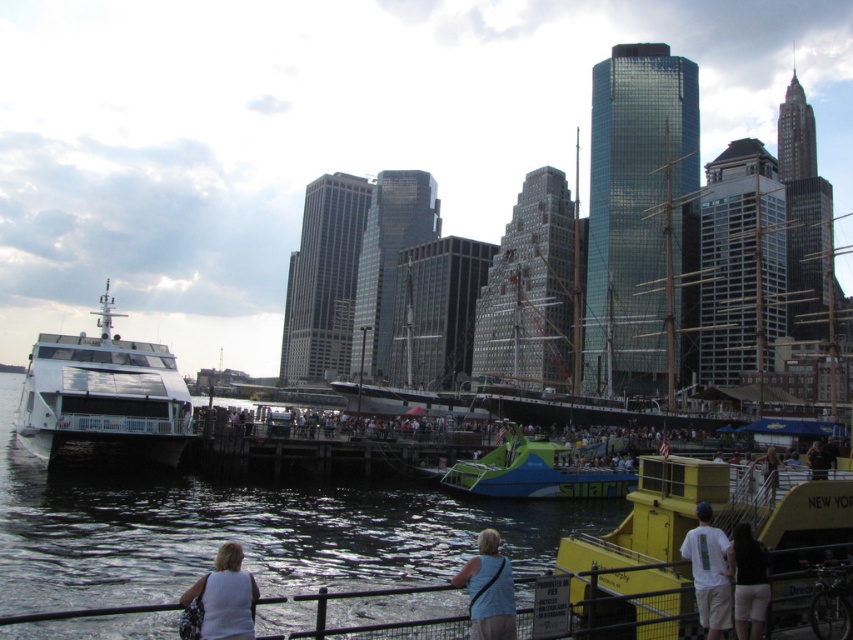
You are a photographer standing at the waterfront. You want to take a photo of the dark brown shorts at lower right without the green and blue plastic boat at center blocking it. What should you do?

Move forward to ensure the dark brown shorts at lower right comes forward relative to the green and blue plastic boat at center, as the dark brown shorts at lower right is currently behind the boat.

You are standing on the pier and want to board the green and blue plastic boat at center. The safety regulations state that you must be at least 50 meters away from the boat to enter the boarding area. Are you currently within the allowed boarding distance?

The green and blue plastic boat at center and viewer are 53.77 meters apart, which is more than the required 50 meters, so you are within the allowed boarding distance.

You are a photographer standing at the waterfront scene. You want to take a photo that includes both the white glossy boat at left and the white matte shirt at lower left. Which object should you focus on first to ensure both are in frame?

You should focus on the white glossy boat at left first because it is much taller than the white matte shirt at lower left, so adjusting the camera angle to include its height will naturally include the smaller shirt in the lower part of the frame.